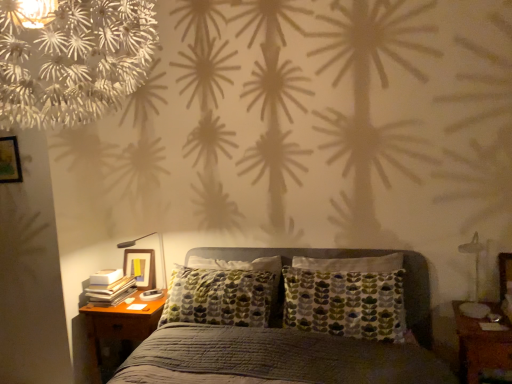
Question: Is point (475, 238) closer or farther from the camera than point (497, 339)?

Choices:
 (A) closer
 (B) farther

Answer: (B)

Question: Is metallic silver bedside lamp at right, the 1th bedside lamp when ordered from front to back, inside the boundaries of brown wooden nightstand at lower right, the first nightstand positioned from the right, or outside?

Choices:
 (A) inside
 (B) outside

Answer: (B)

Question: Which is farther from the wooden nightstand at lower left, which ranks as the 1th nightstand in back-to-front order?

Choices:
 (A) textured gray bed at center
 (B) white paper flower at upper left
 (C) brown wooden nightstand at lower right, which ranks as the second nightstand in back-to-front order
 (D) matte black lamp at left, the 1th bedside lamp in the back-to-front sequence
 (E) metallic silver bedside lamp at right, the 1th bedside lamp when ordered from front to back

Answer: (E)

Question: Which object is the farthest from the wooden picture frame at upper left?

Choices:
 (A) wooden nightstand at lower left, which ranks as the 1th nightstand in back-to-front order
 (B) brown wooden nightstand at lower right, the second nightstand when ordered from left to right
 (C) white paper flower at upper left
 (D) metallic silver bedside lamp at right, positioned as the 1th bedside lamp in right-to-left order
 (E) matte black lamp at left, the 2th bedside lamp in the right-to-left sequence

Answer: (D)